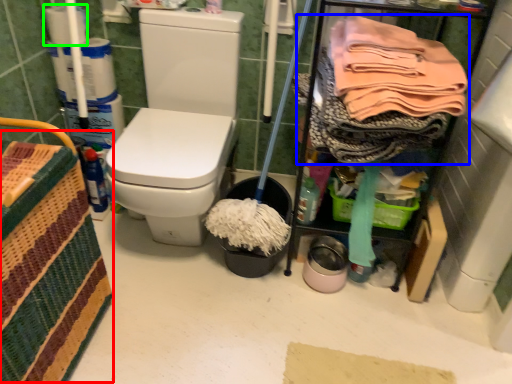
Question: Which object is the closest to the basket (highlighted by a red box)? Choose among these: clothing (highlighted by a blue box) or toilet paper (highlighted by a green box).

Choices:
 (A) clothing
 (B) toilet paper

Answer: (A)